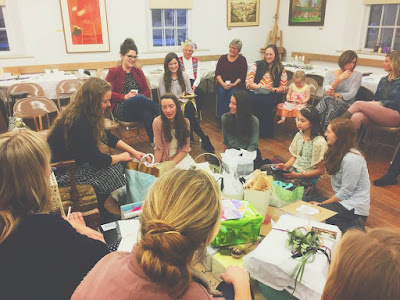
At what (x,y) coordinates should I click in order to perform the action: click on pictures. Please return your answer as a coordinate pair (x, y). Image resolution: width=400 pixels, height=300 pixels. Looking at the image, I should click on (85, 22), (242, 13), (306, 12).